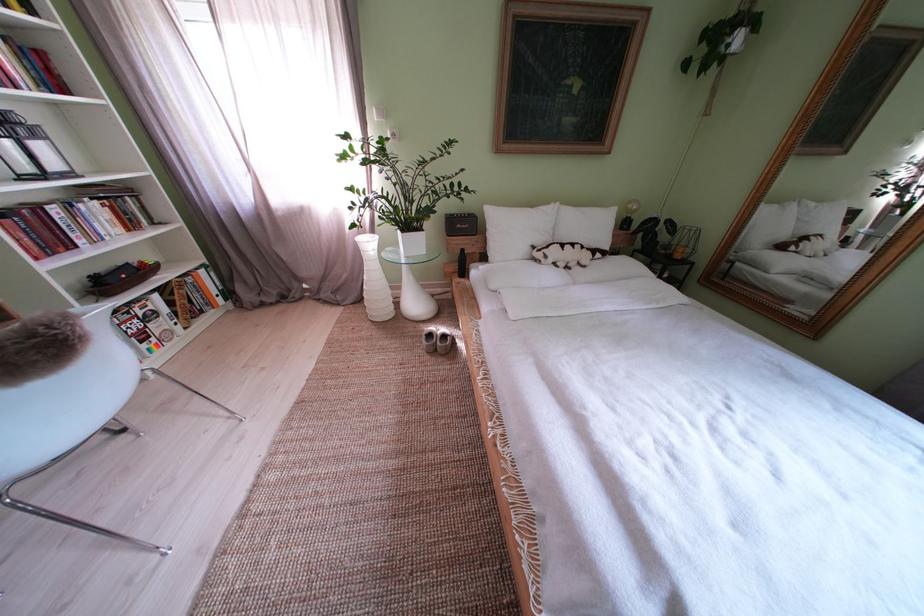
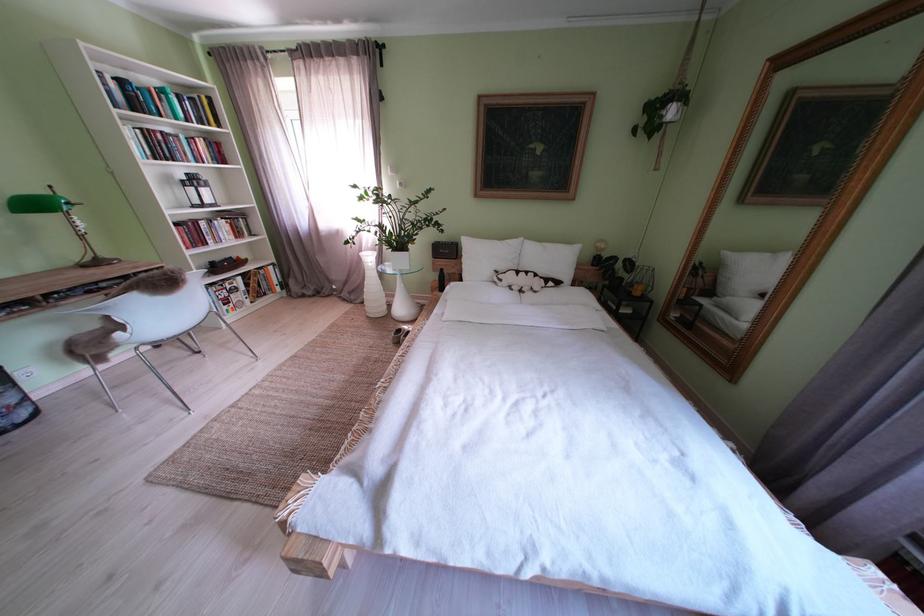
The point at (350, 302) is marked in the first image. Where is the corresponding point in the second image?

(363, 302)